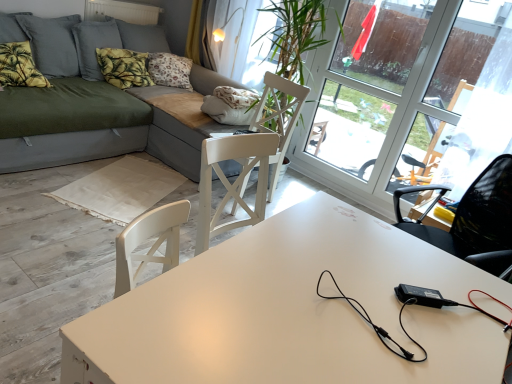
Question: Is green leafy fabric pillow at upper left, the first pillow when ordered from right to left, outside transparent glass window at upper right?

Choices:
 (A) yes
 (B) no

Answer: (A)

Question: Is the position of green leafy fabric pillow at upper left, acting as the second pillow starting from the front, less distant than that of transparent glass window at upper right?

Choices:
 (A) yes
 (B) no

Answer: (B)

Question: Is green leafy fabric pillow at upper left, the first pillow when ordered from right to left, with transparent glass window at upper right?

Choices:
 (A) yes
 (B) no

Answer: (B)

Question: Can you confirm if green leafy fabric pillow at upper left, the first pillow when ordered from right to left, is bigger than transparent glass window at upper right?

Choices:
 (A) no
 (B) yes

Answer: (A)

Question: Is green leafy fabric pillow at upper left, the first pillow when ordered from right to left, thinner than transparent glass window at upper right?

Choices:
 (A) no
 (B) yes

Answer: (A)

Question: Considering the relative positions of white matte table at center and white wood swivel chair at center in the image provided, is white matte table at center to the left or to the right of white wood swivel chair at center?

Choices:
 (A) right
 (B) left

Answer: (A)

Question: Looking at their shapes, would you say white matte table at center is wider or thinner than white wood swivel chair at center?

Choices:
 (A) wide
 (B) thin

Answer: (A)

Question: In the image, is white matte table at center positioned in front of or behind white wood swivel chair at center?

Choices:
 (A) behind
 (B) front

Answer: (B)

Question: Is point (328, 205) positioned closer to the camera than point (298, 94)?

Choices:
 (A) farther
 (B) closer

Answer: (B)

Question: In terms of size, does white matte table at center appear bigger or smaller than yellow-green fabric pillow at upper left, which is counted as the 1th pillow, starting from the front?

Choices:
 (A) big
 (B) small

Answer: (A)

Question: Considering their positions, is white matte table at center located in front of or behind yellow-green fabric pillow at upper left, which is counted as the 1th pillow, starting from the front?

Choices:
 (A) behind
 (B) front

Answer: (B)

Question: Considering the positions of white matte table at center and yellow-green fabric pillow at upper left, positioned as the 2th pillow in right-to-left order, in the image, is white matte table at center wider or thinner than yellow-green fabric pillow at upper left, positioned as the 2th pillow in right-to-left order,?

Choices:
 (A) thin
 (B) wide

Answer: (B)

Question: From a real-world perspective, is white matte table at center positioned above or below yellow-green fabric pillow at upper left, the 1th pillow from the left?

Choices:
 (A) below
 (B) above

Answer: (A)

Question: In terms of height, does transparent glass window at upper right look taller or shorter compared to yellow fabric curtain at upper center?

Choices:
 (A) tall
 (B) short

Answer: (A)

Question: From the image's perspective, relative to yellow fabric curtain at upper center, is transparent glass window at upper right above or below?

Choices:
 (A) below
 (B) above

Answer: (A)